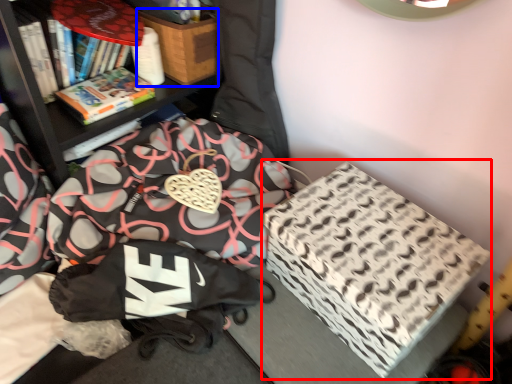
Question: Which object is further to the camera taking this photo, cardboard box (highlighted by a red box) or cardboard box (highlighted by a blue box)?

Choices:
 (A) cardboard box
 (B) cardboard box

Answer: (B)